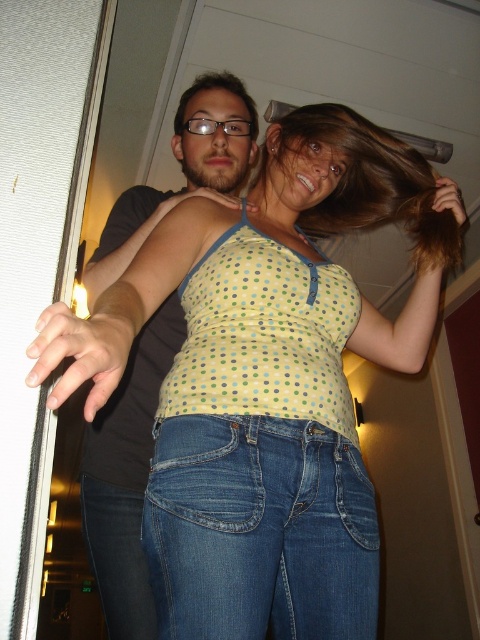
Question: Based on their relative distances, which object is nearer to the brown silky hair at upper center?

Choices:
 (A) blue denim jeans at lower center
 (B) dark gray t-shirt at center

Answer: (B)

Question: Which of these objects is positioned closest to the yellow polka dot tank top at center?

Choices:
 (A) brown silky hair at upper center
 (B) jeans at lower left
 (C) blue denim jeans at lower center
 (D) matte green tank top at center

Answer: (C)

Question: Which of the following is the closest to the observer?

Choices:
 (A) (255, 124)
 (B) (144, 584)
 (C) (244, 563)
 (D) (183, 401)

Answer: (C)

Question: Is dark gray t-shirt at center bigger than jeans at lower left?

Choices:
 (A) yes
 (B) no

Answer: (A)

Question: Is blue denim jeans at lower center bigger than dark gray t-shirt at center?

Choices:
 (A) no
 (B) yes

Answer: (A)

Question: Is brown silky hair at upper center wider than jeans at lower left?

Choices:
 (A) yes
 (B) no

Answer: (A)